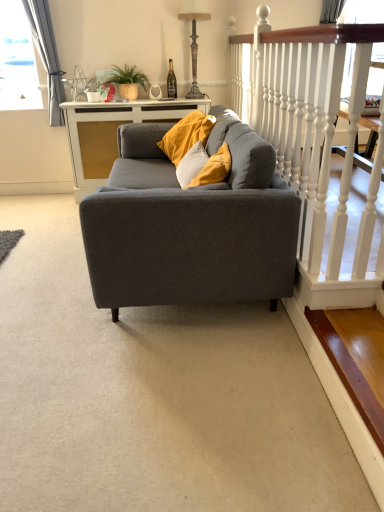
Question: Are wooden stair at lower right and white wooden railing at upper right located far from each other?

Choices:
 (A) yes
 (B) no

Answer: (B)

Question: Is wooden stair at lower right smaller than white wooden railing at upper right?

Choices:
 (A) yes
 (B) no

Answer: (A)

Question: Does wooden stair at lower right have a larger size compared to white wooden railing at upper right?

Choices:
 (A) no
 (B) yes

Answer: (A)

Question: Is wooden stair at lower right taller than white wooden railing at upper right?

Choices:
 (A) yes
 (B) no

Answer: (B)

Question: From the image's perspective, is wooden stair at lower right on white wooden railing at upper right?

Choices:
 (A) no
 (B) yes

Answer: (A)

Question: Would you say wooden stair at lower right is outside white wooden railing at upper right?

Choices:
 (A) yes
 (B) no

Answer: (A)

Question: Is antique bronze lamp at upper center in contact with gray fabric curtain at upper left?

Choices:
 (A) no
 (B) yes

Answer: (A)

Question: Considering the relative sizes of antique bronze lamp at upper center and gray fabric curtain at upper left in the image provided, is antique bronze lamp at upper center taller than gray fabric curtain at upper left?

Choices:
 (A) yes
 (B) no

Answer: (B)

Question: Considering the relative positions of antique bronze lamp at upper center and gray fabric curtain at upper left in the image provided, is antique bronze lamp at upper center to the right of gray fabric curtain at upper left from the viewer's perspective?

Choices:
 (A) yes
 (B) no

Answer: (A)

Question: From a real-world perspective, is antique bronze lamp at upper center physically above gray fabric curtain at upper left?

Choices:
 (A) yes
 (B) no

Answer: (A)

Question: Does antique bronze lamp at upper center lie behind gray fabric curtain at upper left?

Choices:
 (A) yes
 (B) no

Answer: (A)

Question: Could you tell me if antique bronze lamp at upper center is turned towards gray fabric curtain at upper left?

Choices:
 (A) yes
 (B) no

Answer: (B)

Question: Is wooden stair at lower right turned away from matte gray couch at center?

Choices:
 (A) no
 (B) yes

Answer: (A)